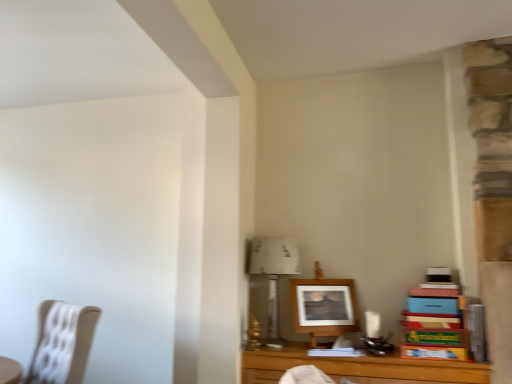
Describe the element at coordinates (359, 367) in the screenshot. The image size is (512, 384). I see `wooden table at lower right` at that location.

Where is `wooden table at lower right`? wooden table at lower right is located at coordinates (359, 367).

This screenshot has height=384, width=512. What do you see at coordinates (272, 273) in the screenshot?
I see `white paper at upper center` at bounding box center [272, 273].

The image size is (512, 384). I want to click on wooden frame at center, so 324,306.

Could you tell me if white paper at upper center is turned towards wooden table at lower right?

No.

From the image's perspective, is white paper at upper center above or below wooden table at lower right?

white paper at upper center is above wooden table at lower right.

Which object is more forward, white paper at upper center or wooden table at lower right?

wooden table at lower right.

Does white paper at upper center have a greater width compared to wooden table at lower right?

No.

Is white paper at upper center at the back of wooden frame at center?

Absolutely, wooden frame at center is directed away from white paper at upper center.

Considering the relative positions of wooden frame at center and white paper at upper center in the image provided, is wooden frame at center to the left or to the right of white paper at upper center?

wooden frame at center is positioned on white paper at upper center's right side.

Which is behind, point (329, 310) or point (296, 256)?

The point (296, 256) is farther from the camera.

Does wooden frame at center lie behind white paper at upper center?

Yes.

Can you see wooden frame at center touching wooden table at lower right?

No, wooden frame at center is not in contact with wooden table at lower right.

Which of these two, wooden frame at center or wooden table at lower right, is bigger?

With larger size is wooden table at lower right.

From the image's perspective, which object appears higher, wooden frame at center or wooden table at lower right?

wooden frame at center is shown above in the image.

Is beige fabric chair at left to the right of white paper at upper center from the viewer's perspective?

No, beige fabric chair at left is not to the right of white paper at upper center.

You are a GUI agent. You are given a task and a screenshot of the screen. Output one action in this format:
    pyautogui.click(x=<x>, y=<y>)
    Task: Click on the chair below the white paper at upper center (from a real-world perspective)
    The image size is (512, 384).
    Given the screenshot: What is the action you would take?
    pyautogui.click(x=62, y=343)

Which point is more distant from viewer, [61,325] or [249,265]?

The point [249,265] is farther.

Is beige fabric chair at left positioned far away from wooden table at lower right?

beige fabric chair at left is positioned a significant distance from wooden table at lower right.

From the picture: In terms of size, does beige fabric chair at left appear bigger or smaller than wooden table at lower right?

In the image, beige fabric chair at left appears to be larger than wooden table at lower right.

Is beige fabric chair at left oriented away from wooden table at lower right?

beige fabric chair at left does not have its back to wooden table at lower right.

From a real-world perspective, which is physically above, white paper at upper center or beige fabric chair at left?

In real-world perspective, white paper at upper center is above.

How different are the orientations of white paper at upper center and beige fabric chair at left in degrees?

There is a 29.1-degree angle between the facing directions of white paper at upper center and beige fabric chair at left.

Identify the location of table lamp on the right of beige fabric chair at left. Image resolution: width=512 pixels, height=384 pixels. (272, 273).

Which point is more distant from viewer, (269, 260) or (55, 369)?

The point (269, 260) is behind.

Is wooden table at lower right to the right of white paper at upper center from the viewer's perspective?

Indeed, wooden table at lower right is positioned on the right side of white paper at upper center.

Where is `table below the white paper at upper center (from the image's perspective)`? Image resolution: width=512 pixels, height=384 pixels. table below the white paper at upper center (from the image's perspective) is located at coordinates click(359, 367).

From the image's perspective, between wooden table at lower right and white paper at upper center, which one is located above?

From the image's view, white paper at upper center is above.

Identify the location of table lamp that appears behind the wooden table at lower right. (272, 273).

Find the location of `picture frame beneath the white paper at upper center (from a real-world perspective)`. picture frame beneath the white paper at upper center (from a real-world perspective) is located at coordinates (324, 306).

Estimate the real-world distances between objects in this image. Which object is further from wooden table at lower right, wooden frame at center or beige fabric chair at left?

beige fabric chair at left is positioned further to the anchor wooden table at lower right.

Considering their positions, is wooden frame at center positioned further to white paper at upper center than beige fabric chair at left?

The object further to white paper at upper center is beige fabric chair at left.

Estimate the real-world distances between objects in this image. Which object is closer to beige fabric chair at left, white paper at upper center or wooden frame at center?

white paper at upper center.

Looking at the image, which one is located further to wooden table at lower right, wooden frame at center or white paper at upper center?

white paper at upper center is positioned further to the anchor wooden table at lower right.

Considering their positions, is wooden frame at center positioned closer to beige fabric chair at left than wooden table at lower right?

Among the two, wooden table at lower right is located nearer to beige fabric chair at left.

Considering their positions, is white paper at upper center positioned further to wooden table at lower right than wooden frame at center?

The object further to wooden table at lower right is white paper at upper center.

Looking at the image, which one is located further to wooden table at lower right, beige fabric chair at left or white paper at upper center?

beige fabric chair at left.

Estimate the real-world distances between objects in this image. Which object is closer to white paper at upper center, wooden table at lower right or beige fabric chair at left?

wooden table at lower right lies closer to white paper at upper center than the other object.

Locate an element on the screen. This screenshot has width=512, height=384. picture frame between beige fabric chair at left and wooden table at lower right from left to right is located at coordinates (324, 306).

Locate an element on the screen. table lamp positioned between wooden table at lower right and wooden frame at center from near to far is located at coordinates (272, 273).

This screenshot has height=384, width=512. Find the location of `table lamp between beige fabric chair at left and wooden table at lower right from left to right`. table lamp between beige fabric chair at left and wooden table at lower right from left to right is located at coordinates (272, 273).

What are the coordinates of `table lamp between beige fabric chair at left and wooden frame at center in the horizontal direction` in the screenshot? It's located at (272, 273).